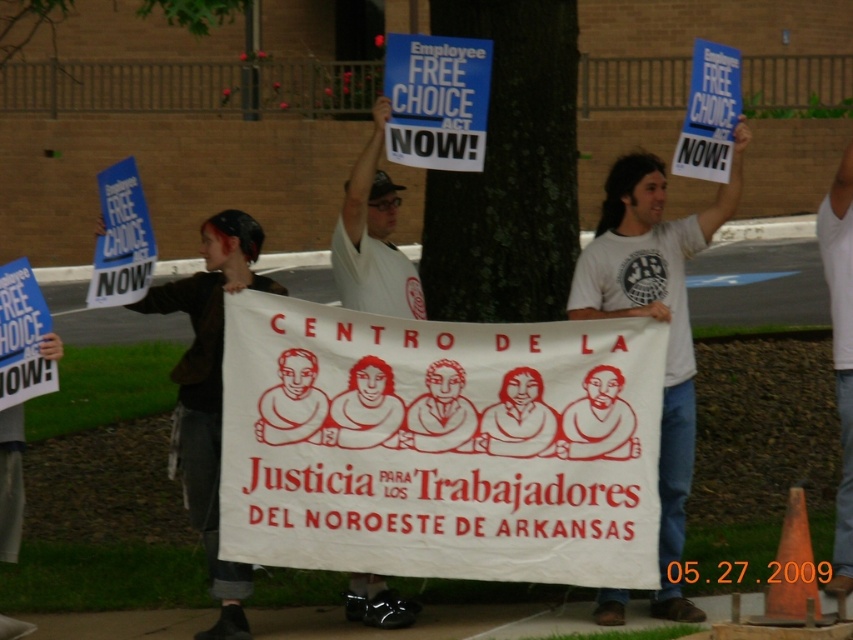
Question: Which of the following is the closest to the observer?

Choices:
 (A) (643, 180)
 (B) (450, 38)
 (C) (422, 360)

Answer: (C)

Question: Can you confirm if green rough bark tree at center is positioned to the right of white t-shirt at center?

Choices:
 (A) yes
 (B) no

Answer: (B)

Question: Is green rough bark tree at center above blue paper sign at upper center?

Choices:
 (A) no
 (B) yes

Answer: (A)

Question: Is white paper banner at center closer to the viewer compared to white paper sign at center?

Choices:
 (A) no
 (B) yes

Answer: (B)

Question: Which point is closer to the camera?

Choices:
 (A) (334, 456)
 (B) (833, 252)

Answer: (A)

Question: Among these points, which one is farthest from the camera?

Choices:
 (A) coord(349,586)
 (B) coord(543,364)

Answer: (A)